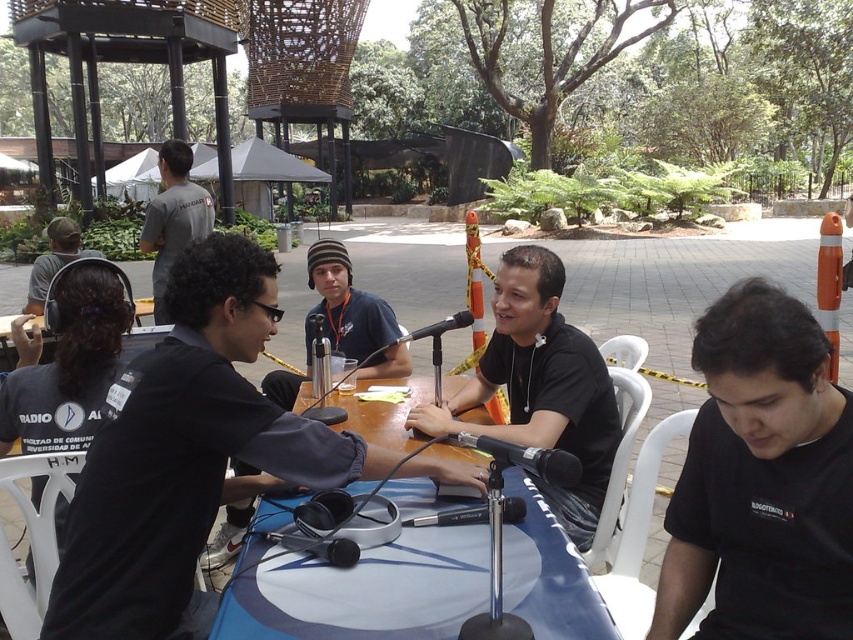
You are a guest speaker at the event and need to locate your equipment. You see the black matte headphones at center and the dark blue knit beanie at center on the table. Which object is positioned to the left of the other?

The black matte headphones at center are to the left of the dark blue knit beanie at center.

In the scene shown: You are standing in the park where the radio broadcast is happening. There is a dark blue knit beanie at center located at point (x=351, y=316). If you want to find the beanie, which direction should you look relative to the table covered with a blue cloth?

The dark blue knit beanie at center is located at point (x=351, y=316), which is at the center of the image. Since the table is in the foreground and the beanie is at the center, you should look towards the middle area of the scene to find the beanie.

You are setting up equipment for a live outdoor broadcast. You have the black matte headphones at center and the metallic silver microphone at center on the table. Which item takes up more space on the table?

The black matte headphones at center is bigger than the metallic silver microphone at center, so it takes up more space on the table.